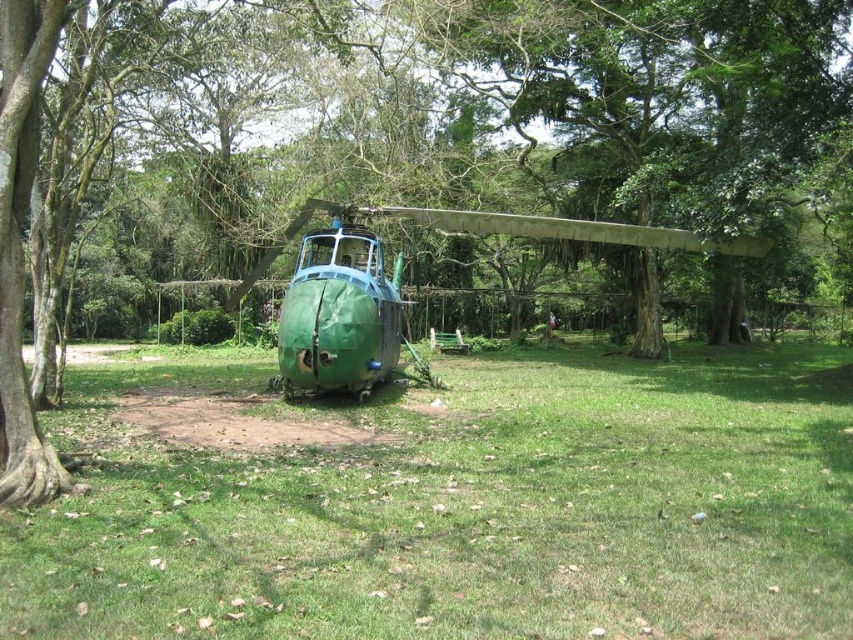
Question: Can you confirm if green grass at center is positioned below green matte helicopter at center?

Choices:
 (A) no
 (B) yes

Answer: (B)

Question: Among these objects, which one is nearest to the camera?

Choices:
 (A) green grass at center
 (B) green matte helicopter at center

Answer: (A)

Question: Can you confirm if green grass at center is thinner than green matte helicopter at center?

Choices:
 (A) no
 (B) yes

Answer: (A)

Question: Does green grass at center have a smaller size compared to green matte helicopter at center?

Choices:
 (A) no
 (B) yes

Answer: (B)

Question: Which point is closer to the camera taking this photo?

Choices:
 (A) (569, 548)
 (B) (267, 260)

Answer: (A)